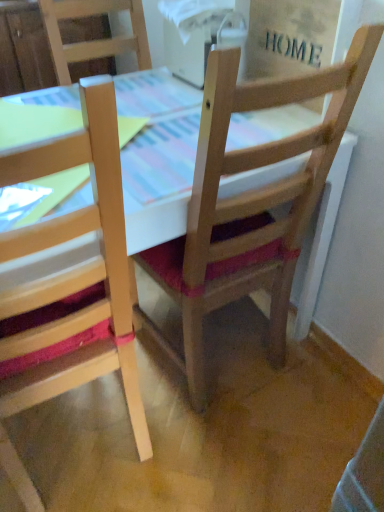
Question: Should I look upward or downward to see wooden chair at center, acting as the 2th chair starting from the left?

Choices:
 (A) up
 (B) down

Answer: (A)

Question: Is wooden table at center at the right side of wooden chair at center, acting as the 2th chair starting from the left?

Choices:
 (A) yes
 (B) no

Answer: (B)

Question: Considering the relative positions of wooden table at center and wooden chair at center, which is the 1th chair in right-to-left order, in the image provided, is wooden table at center to the left of wooden chair at center, which is the 1th chair in right-to-left order, from the viewer's perspective?

Choices:
 (A) yes
 (B) no

Answer: (A)

Question: Considering the relative sizes of wooden table at center and wooden chair at center, acting as the 2th chair starting from the left, in the image provided, is wooden table at center taller than wooden chair at center, acting as the 2th chair starting from the left,?

Choices:
 (A) no
 (B) yes

Answer: (A)

Question: Is the depth of wooden table at center less than that of wooden chair at center, which is the 1th chair in right-to-left order?

Choices:
 (A) no
 (B) yes

Answer: (A)

Question: From the image's perspective, is wooden table at center above wooden chair at center, acting as the 2th chair starting from the left?

Choices:
 (A) yes
 (B) no

Answer: (B)

Question: Is wooden table at center smaller than wooden chair at center, acting as the 2th chair starting from the left?

Choices:
 (A) no
 (B) yes

Answer: (A)

Question: Is wooden chair at center, which is the 1th chair in right-to-left order, completely or partially outside of wooden table at center?

Choices:
 (A) yes
 (B) no

Answer: (B)

Question: Considering the relative sizes of wooden chair at center, acting as the 2th chair starting from the left, and wooden table at center in the image provided, is wooden chair at center, acting as the 2th chair starting from the left, wider than wooden table at center?

Choices:
 (A) yes
 (B) no

Answer: (B)

Question: Considering the relative sizes of wooden chair at center, acting as the 2th chair starting from the left, and wooden table at center in the image provided, is wooden chair at center, acting as the 2th chair starting from the left, thinner than wooden table at center?

Choices:
 (A) yes
 (B) no

Answer: (A)

Question: Can you confirm if wooden chair at center, acting as the 2th chair starting from the left, is bigger than wooden table at center?

Choices:
 (A) no
 (B) yes

Answer: (A)

Question: Is wooden chair at center, which is the 1th chair in right-to-left order, smaller than wooden table at center?

Choices:
 (A) yes
 (B) no

Answer: (A)

Question: From the image's perspective, is wooden chair at center, acting as the 2th chair starting from the left, located beneath wooden table at center?

Choices:
 (A) no
 (B) yes

Answer: (A)

Question: Is wooden chair at center, which is the 1th chair in right-to-left order, aimed at natural wood chair at left, placed as the first chair when sorted from left to right?

Choices:
 (A) yes
 (B) no

Answer: (B)